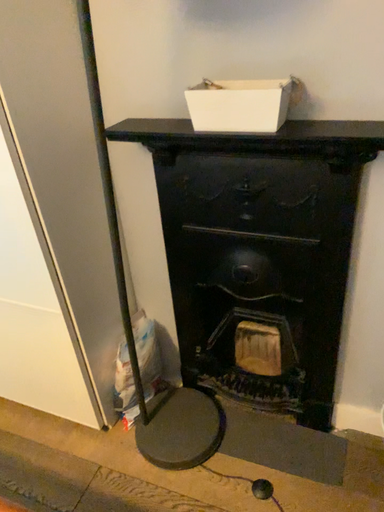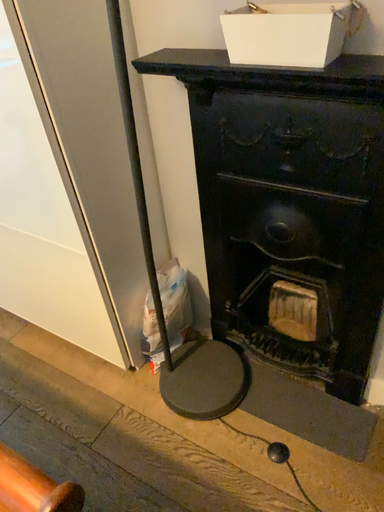
Question: How did the camera likely rotate when shooting the video?

Choices:
 (A) rotated downward
 (B) rotated upward

Answer: (A)